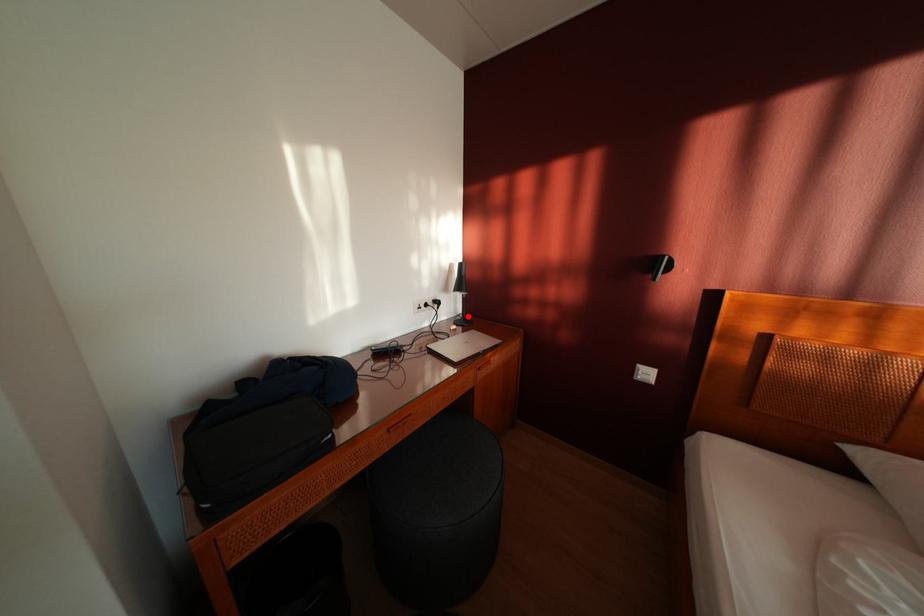
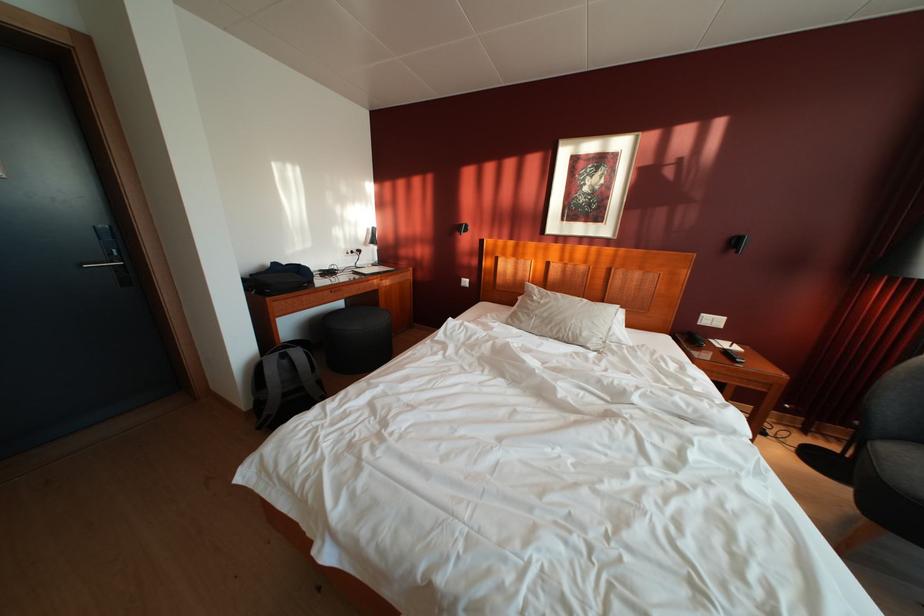
The point at the highlighted location is marked in the first image. Where is the corresponding point in the second image?

(384, 265)